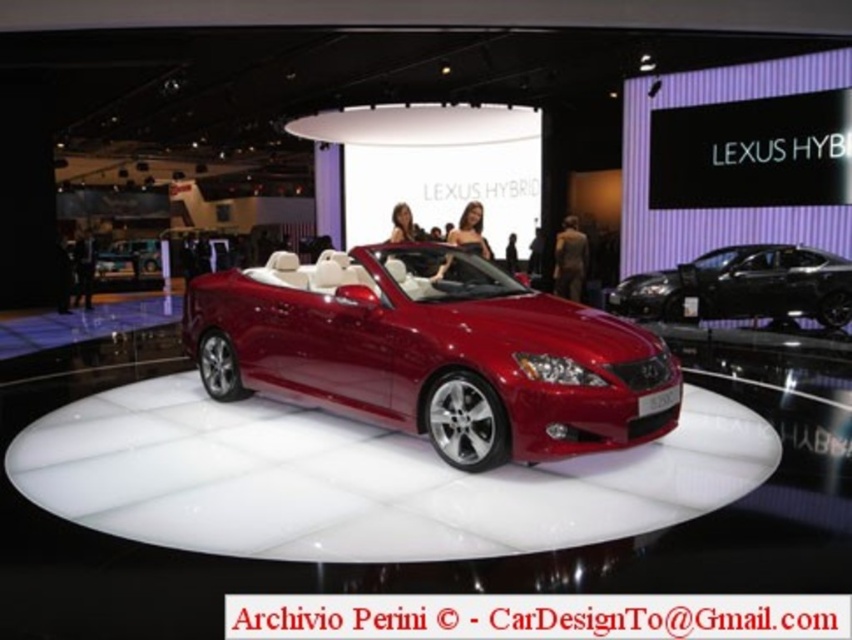
Is point (746, 289) positioned before point (137, 260)?

Yes, it is.

In order to click on glossy black sedan at center in this screenshot , I will do `click(743, 285)`.

At what (x,y) coordinates should I click in order to perform the action: click on shiny red convertible at center. Please return your answer as a coordinate pair (x, y). This screenshot has width=852, height=640. Looking at the image, I should click on (435, 353).

Does shiny red convertible at center appear on the left side of glossy black sedan at center?

Indeed, shiny red convertible at center is positioned on the left side of glossy black sedan at center.

Between shiny red convertible at center and glossy black sedan at center, which one appears on the right side from the viewer's perspective?

glossy black sedan at center

Identify the location of shiny red convertible at center. (435, 353).

Locate an element on the screen. Image resolution: width=852 pixels, height=640 pixels. shiny red convertible at center is located at coordinates (435, 353).